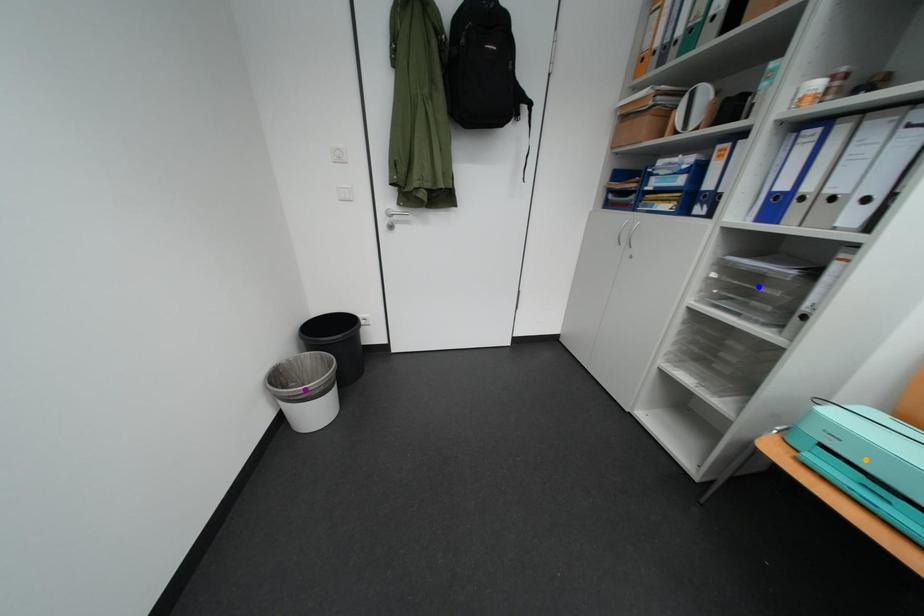
Order these from farthest to nearest:
purple point
orange point
blue point

purple point, blue point, orange point